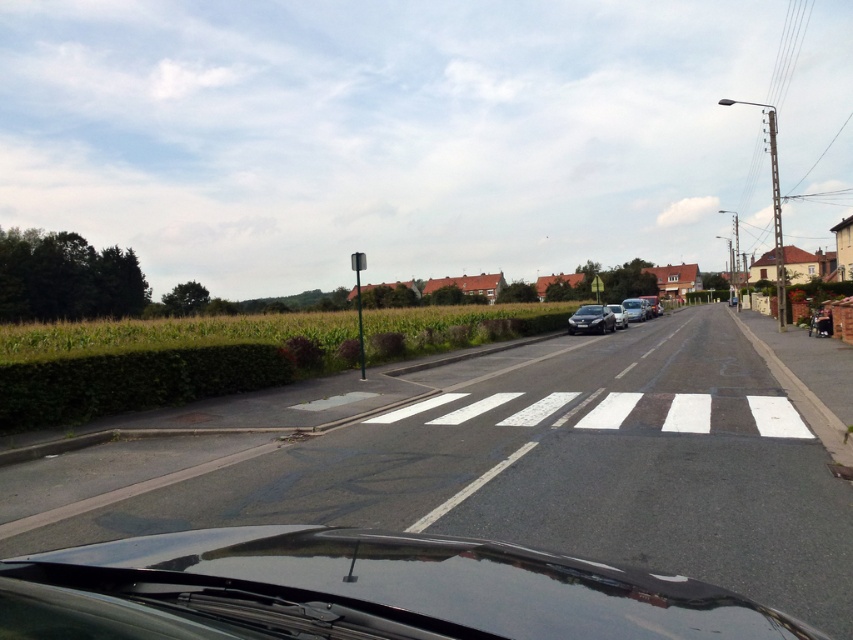
You are a passenger in the glossy black car at center. You look out the window and see the houses with red roofs in the distance. Can you estimate how far the houses with red roofs are from your current position based on the car position coordinates?

The glossy black car at center is located at coordinates point (358, 592). However, without additional information about the scale or distance units in the scene, it is impossible to accurately estimate the distance to the houses with red roofs.